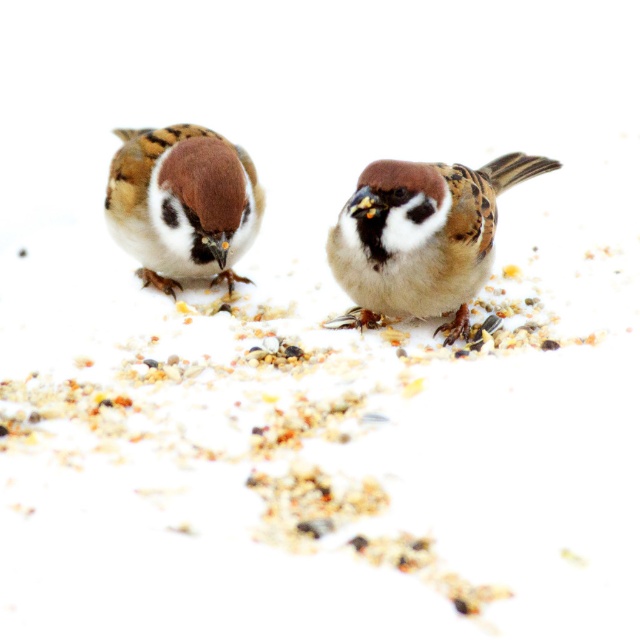
Question: Which point is farther to the camera?

Choices:
 (A) (168, 177)
 (B) (412, 310)

Answer: (B)

Question: Is brown matte sparrow at center below brown matte sparrow at left?

Choices:
 (A) yes
 (B) no

Answer: (A)

Question: Is brown matte sparrow at center thinner than brown matte sparrow at left?

Choices:
 (A) no
 (B) yes

Answer: (A)

Question: Which of the following is the closest to the observer?

Choices:
 (A) brown matte sparrow at left
 (B) brown matte sparrow at center

Answer: (B)

Question: Observing the image, what is the correct spatial positioning of brown matte sparrow at center in reference to brown matte sparrow at left?

Choices:
 (A) above
 (B) below

Answer: (B)